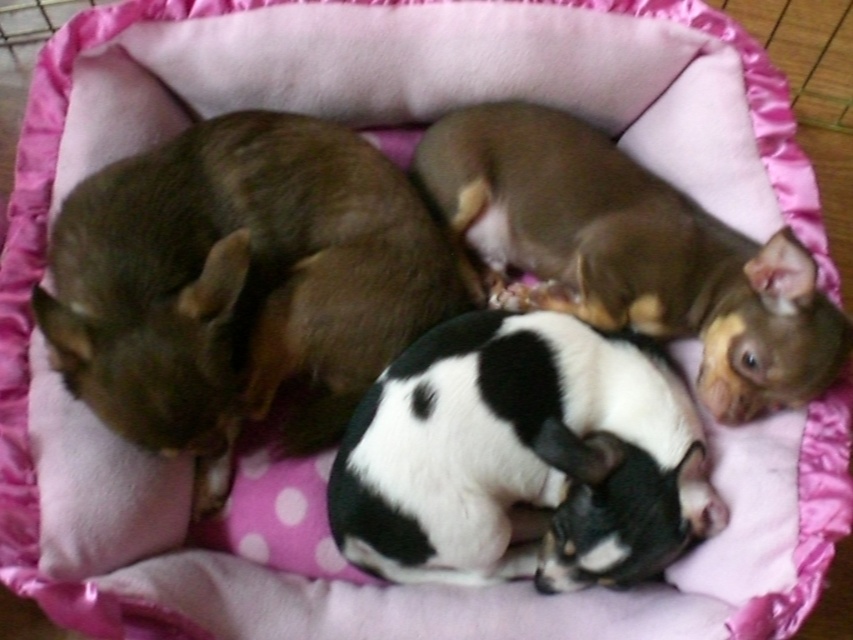
Question: Which point is closer to the camera?

Choices:
 (A) black and white fur at center
 (B) brown fur dog at left
 (C) brown furry dog at upper right

Answer: (B)

Question: Can you confirm if black and white fur at center is positioned to the left of brown furry dog at upper right?

Choices:
 (A) no
 (B) yes

Answer: (B)

Question: Considering the real-world distances, which object is farthest from the brown fur dog at left?

Choices:
 (A) black and white fur at center
 (B) brown furry dog at upper right

Answer: (B)

Question: Which of these objects is positioned closest to the brown furry dog at upper right?

Choices:
 (A) black and white fur at center
 (B) brown fur dog at left

Answer: (A)

Question: Is black and white fur at center positioned in front of brown furry dog at upper right?

Choices:
 (A) yes
 (B) no

Answer: (A)

Question: Where is brown fur dog at left located in relation to brown furry dog at upper right in the image?

Choices:
 (A) below
 (B) above

Answer: (A)